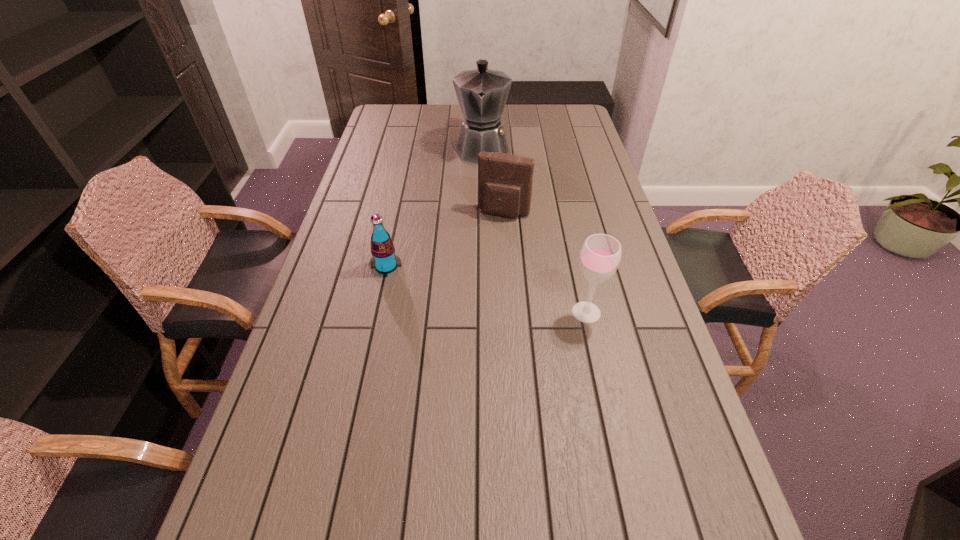
The image size is (960, 540). In order to click on the second nearest object in this screenshot , I will do `click(384, 260)`.

This screenshot has height=540, width=960. Identify the location of soda. (384, 260).

Locate an element on the screen. This screenshot has width=960, height=540. the rightmost object is located at coordinates (600, 256).

Locate an element on the screen. the nearest object is located at coordinates (600, 256).

This screenshot has width=960, height=540. What are the coordinates of `the tallest object` in the screenshot? It's located at (482, 93).

At what (x,y) coordinates should I click in order to perform the action: click on coffeepot. Please return your answer as a coordinate pair (x, y). This screenshot has width=960, height=540. Looking at the image, I should click on (482, 93).

This screenshot has height=540, width=960. I want to click on pouch, so click(x=505, y=181).

Where is `free location located on the front of the second nearest object`? Image resolution: width=960 pixels, height=540 pixels. free location located on the front of the second nearest object is located at coordinates (359, 393).

I want to click on free space located 0.050m on the right of the nearest object, so click(623, 312).

Where is `free space located 0.180m at the spout of the coffeepot`? The image size is (960, 540). free space located 0.180m at the spout of the coffeepot is located at coordinates (480, 197).